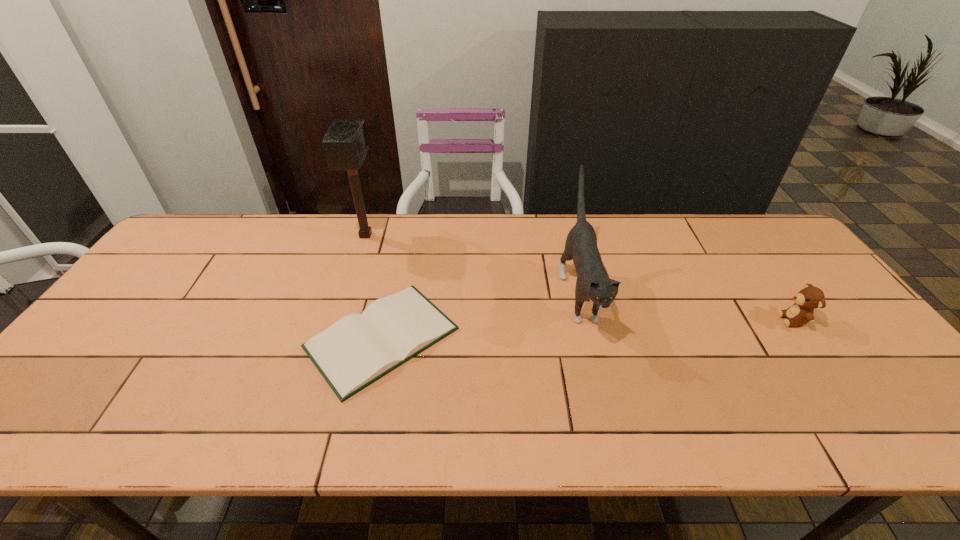
Identify the location of the tallest object. Image resolution: width=960 pixels, height=540 pixels. click(x=345, y=143).

I want to click on the third object from left to right, so click(x=593, y=284).

Image resolution: width=960 pixels, height=540 pixels. In order to click on the second tallest object in this screenshot , I will do `click(593, 284)`.

Locate an element on the screen. teddy bear is located at coordinates (806, 300).

At what (x,y) coordinates should I click in order to perform the action: click on the rightmost object. Please return your answer as a coordinate pair (x, y). This screenshot has width=960, height=540. Looking at the image, I should click on (806, 300).

Where is `hardback book`? hardback book is located at coordinates (359, 349).

You are a GUI agent. You are given a task and a screenshot of the screen. Output one action in this format:
    pyautogui.click(x=<x>, y=<y>)
    Task: Click on the vacant position located on the right of the mallet
    Image resolution: width=960 pixels, height=540 pixels.
    Given the screenshot: What is the action you would take?
    pyautogui.click(x=484, y=235)

The height and width of the screenshot is (540, 960). Identify the location of free space located at the face of the second tallest object. (599, 374).

Locate an element on the screen. This screenshot has width=960, height=540. free space located 0.340m on the face of the teddy bear is located at coordinates (651, 320).

I want to click on free point located on the face of the teddy bear, so pos(689,320).